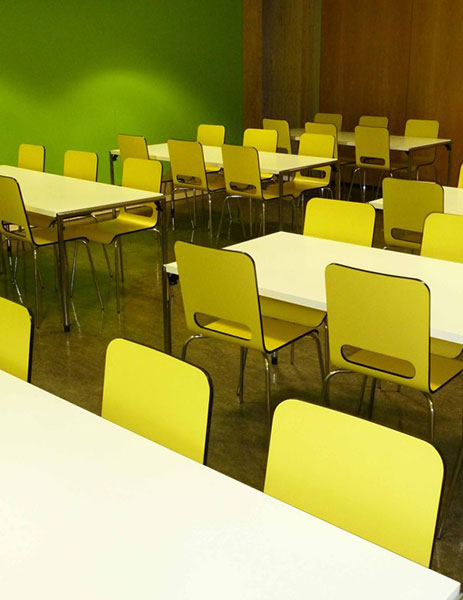
Identify the location of white table. (399, 147), (296, 163), (457, 197), (289, 265), (75, 201), (54, 460).